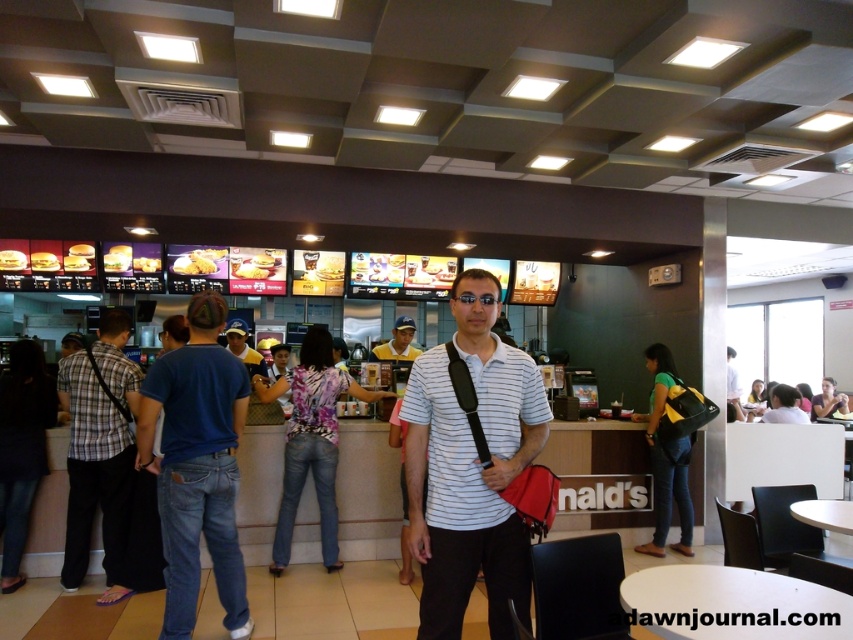
What is the color of the shirt at the point with coordinates (x=244, y=348)?

The point at coordinates (x=244, y=348) is on a matte blue shirt at center.

You are a customer at McDonalds and want to locate the employee wearing the white striped shirt at center. According to the coordinates provided, where should you look in the image?

The white striped shirt at center is located at coordinates point (471, 467) in the image.

Where is the white striped shirt at center located in the image?

→ The white striped shirt at center is located at point (x=471, y=467).